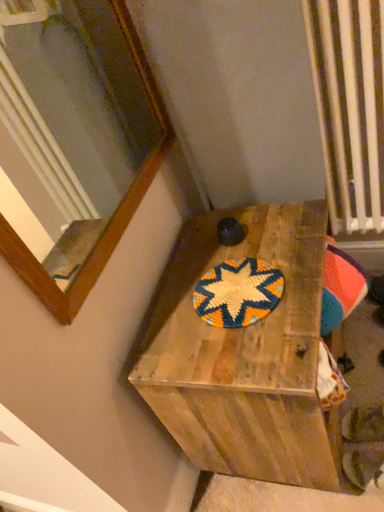
The width and height of the screenshot is (384, 512). In order to click on free point below brightly woven mat at center (from a real-world perspective) in this screenshot , I will do `click(233, 301)`.